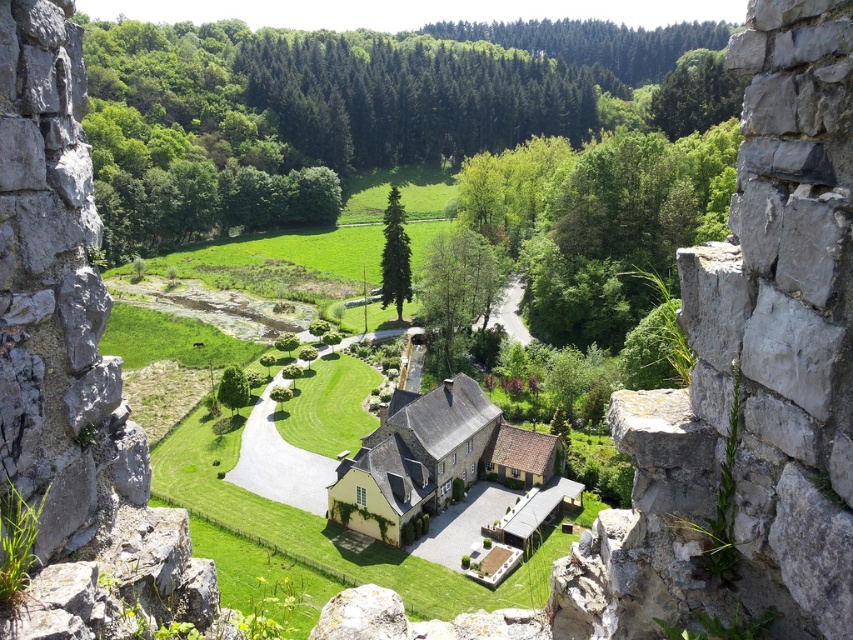
You are a surveyor planning to install a fence between the rough stone wall at left and the yellow matte house at center. The fence requires a straight path with a minimum clearance of 50 meters between the two points. Based on the scene, will the existing distance suffice for your plan?

The distance between the rough stone wall at left and the yellow matte house at center is 54.06 meters, which exceeds the required 50 meters. Therefore, the existing distance is sufficient for the fence installation with the specified clearance.

You are a drone operator trying to capture aerial footage of the yellow matte house at center and the green grass at center. Based on their heights, which one would appear closer to the camera when viewed from above?

The yellow matte house at center has a lesser height compared to green grass at center, so when viewed from above, the green grass at center would appear closer to the camera because it is taller and thus more prominent in the foreground.

You are standing at the top of the ruins and want to walk down to the yellow matte house at center. Which object would you pass first as you descend from the rough stone wall at left?

You would first pass the rough stone wall at left as you descend since it is closer to the viewer than the yellow matte house at center.